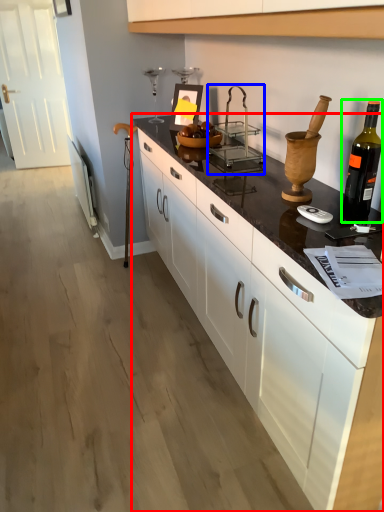
Question: Considering the real-world distances, which object is closest to countertop (highlighted by a red box)? appliance (highlighted by a blue box) or bottle (highlighted by a green box).

Choices:
 (A) appliance
 (B) bottle

Answer: (B)